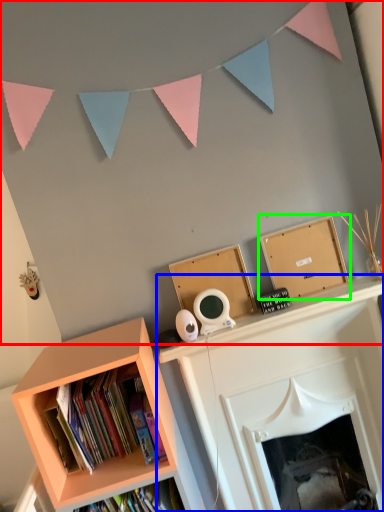
Question: Which object is positioned farthest from backdrop (highlighted by a red box)? Select from fireplace (highlighted by a blue box) and shelf (highlighted by a green box).

Choices:
 (A) fireplace
 (B) shelf

Answer: (A)